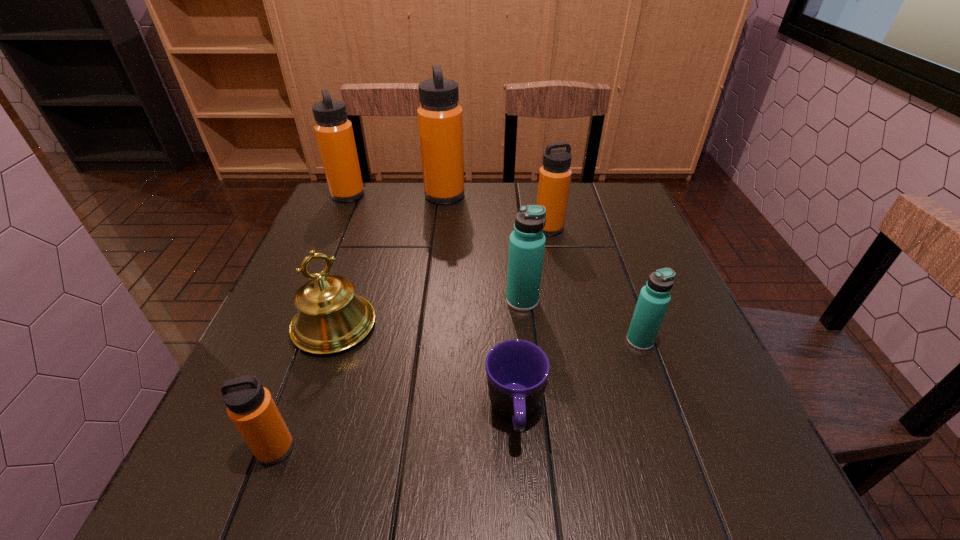
I want to click on vacant space situated 0.050m on the left of the rightmost thermos bottle, so coord(602,341).

The height and width of the screenshot is (540, 960). I want to click on free space located 0.240m on the back of the smallest orange thermos bottle, so click(x=320, y=326).

I want to click on free space located with the handle on the side of the shortest object, so click(x=520, y=497).

Locate an element on the screen. thermos bottle that is at the near edge is located at coordinates (250, 406).

Locate an element on the screen. mug located at the near edge is located at coordinates (517, 370).

The height and width of the screenshot is (540, 960). What are the coordinates of `bell located at the left edge` in the screenshot? It's located at (331, 318).

This screenshot has height=540, width=960. Find the location of `object that is positioned at the right edge`. object that is positioned at the right edge is located at coordinates (654, 298).

Where is `object present at the far left corner`? The width and height of the screenshot is (960, 540). object present at the far left corner is located at coordinates (334, 133).

Where is `object situated at the near left corner`? The image size is (960, 540). object situated at the near left corner is located at coordinates (250, 406).

I want to click on free point at the far edge, so pos(496,183).